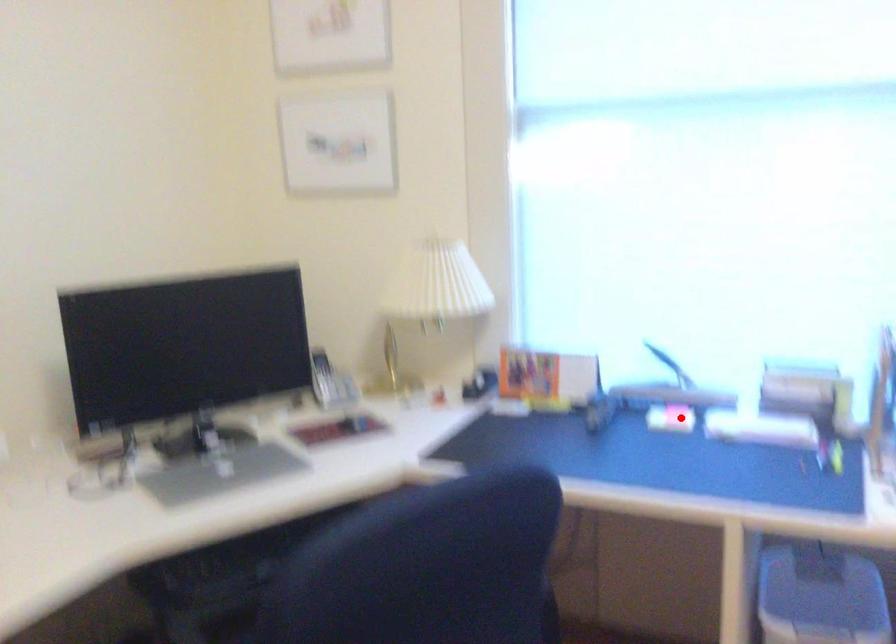
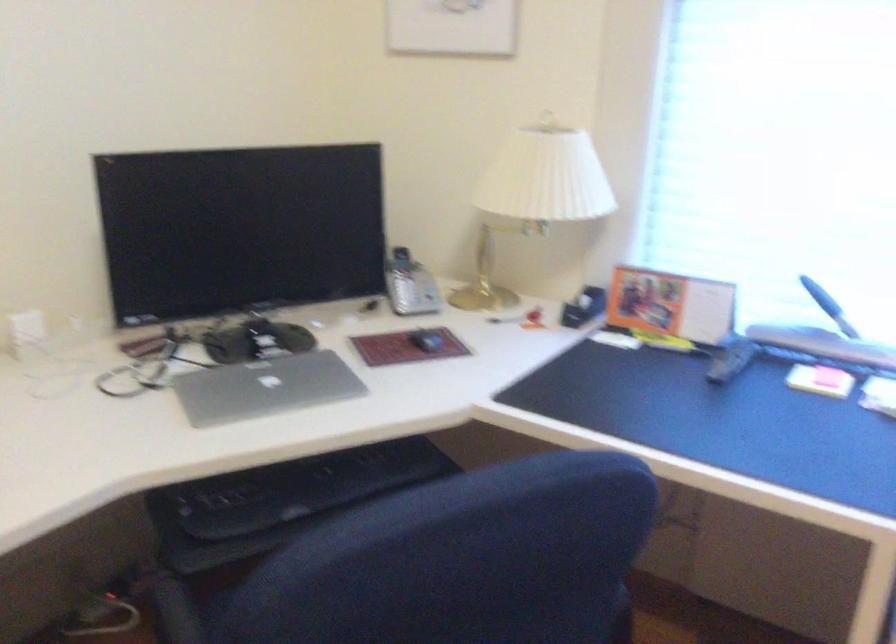
Question: I am providing you with two images of the same scene from different viewpoints. Image1 has a red point marked. In image2, the corresponding 3D location appears at what relative position? Reply with the corresponding letter.

Choices:
 (A) Closer
 (B) Farther

Answer: (A)